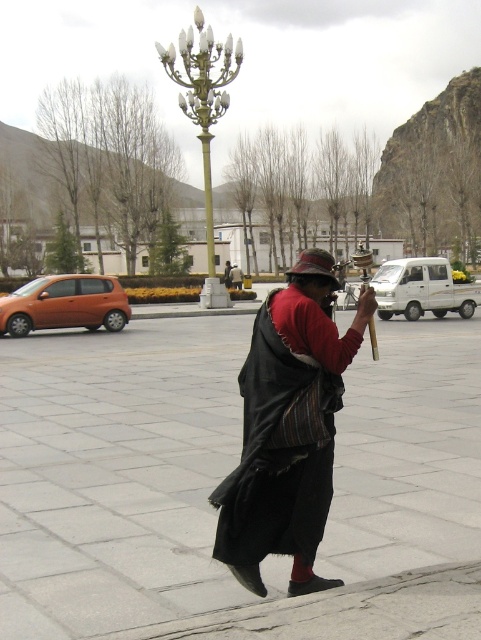
Measure the distance between black woolen robe at center and camera.

A distance of 3.66 meters exists between black woolen robe at center and camera.

Between black woolen robe at center and gold polished metal lamp post at upper center, which one is positioned lower?

black woolen robe at center

Describe the element at coordinates (283, 440) in the screenshot. I see `black woolen robe at center` at that location.

Find the location of a particular element. black woolen robe at center is located at coordinates pos(283,440).